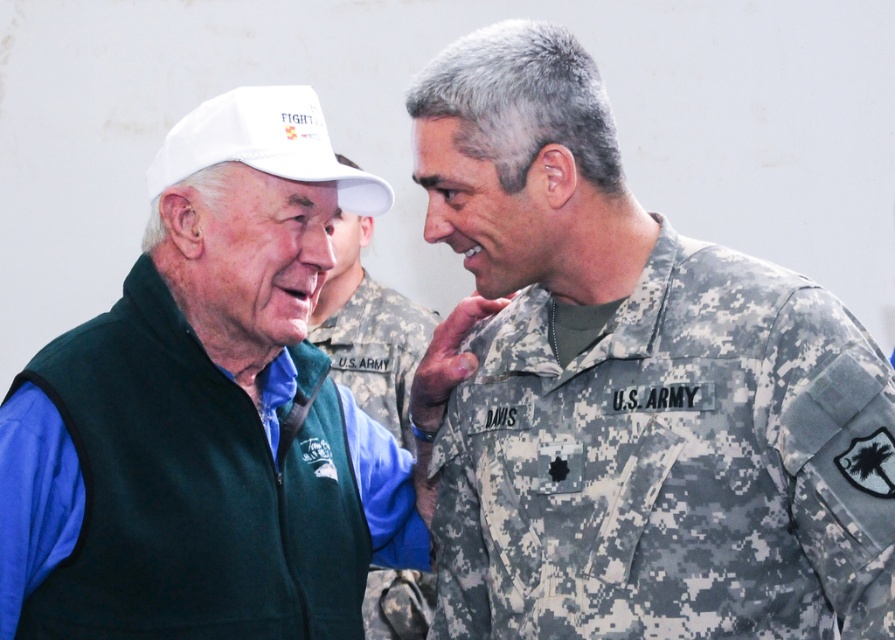
Question: Which object is the farthest from the white matte baseball cap at upper left?

Choices:
 (A) green fleece vest at left
 (B) camouflage fabric us army uniform at center

Answer: (B)

Question: Which point is farther to the camera?

Choices:
 (A) green fleece vest at left
 (B) camouflage fabric us army uniform at center

Answer: (A)

Question: Which point appears farthest from the camera in this image?

Choices:
 (A) tap(424, 602)
 (B) tap(235, 538)
 (C) tap(787, 442)

Answer: (A)

Question: Can you confirm if camouflage fabric us army uniform at center is smaller than white matte baseball cap at upper left?

Choices:
 (A) yes
 (B) no

Answer: (B)

Question: Where is green fleece vest at left located in relation to white matte baseball cap at upper left in the image?

Choices:
 (A) above
 (B) below

Answer: (B)

Question: Can you confirm if camouflage fabric us army uniform at center is positioned to the left of white matte baseball cap at upper left?

Choices:
 (A) yes
 (B) no

Answer: (B)